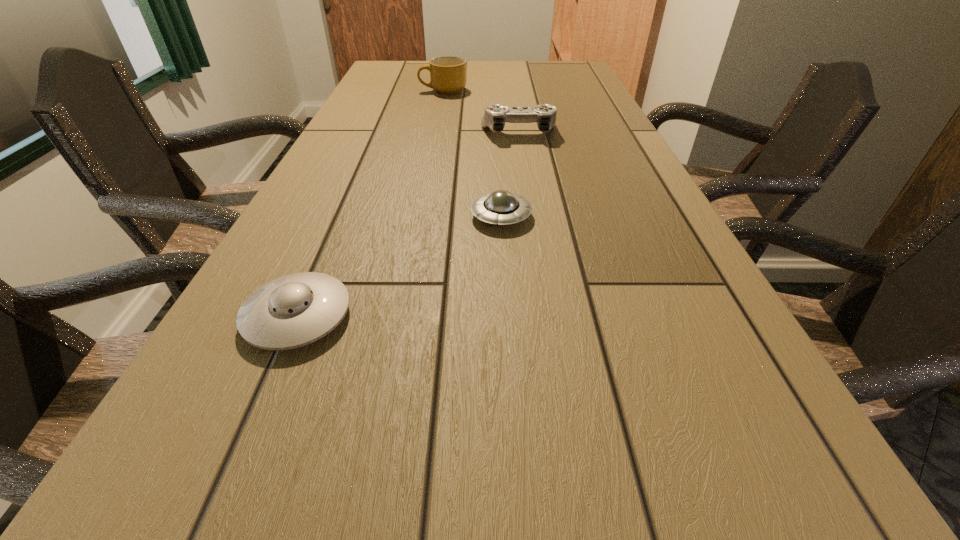
Image resolution: width=960 pixels, height=540 pixels. In order to click on object that can be found as the third closest to the left saucer in this screenshot , I will do `click(448, 76)`.

You are a GUI agent. You are given a task and a screenshot of the screen. Output one action in this format:
    pyautogui.click(x=<x>, y=<y>)
    Task: Click on the vacant point that satisfies the following two spatial constraints: 1. on the back side of the farther saucer; 2. on the left side of the nearer saucer
    This screenshot has height=540, width=960.
    Given the screenshot: What is the action you would take?
    pyautogui.click(x=341, y=216)

Identify the location of blank area in the image that satisfies the following two spatial constraints: 1. on the back side of the left saucer; 2. on the left side of the second tallest object. The width and height of the screenshot is (960, 540). (376, 132).

Find the location of a particular element. The height and width of the screenshot is (540, 960). vacant space that satisfies the following two spatial constraints: 1. on the back side of the third farthest object; 2. on the right side of the nearest object is located at coordinates (341, 216).

Image resolution: width=960 pixels, height=540 pixels. In order to click on vacant space that satisfies the following two spatial constraints: 1. on the back side of the nearest object; 2. on the left side of the control in this screenshot , I will do coord(376,132).